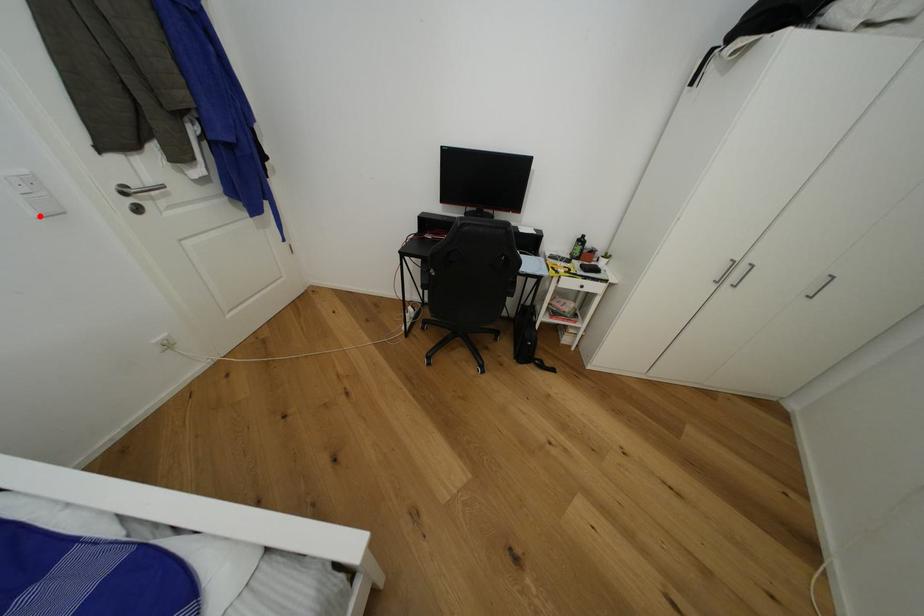
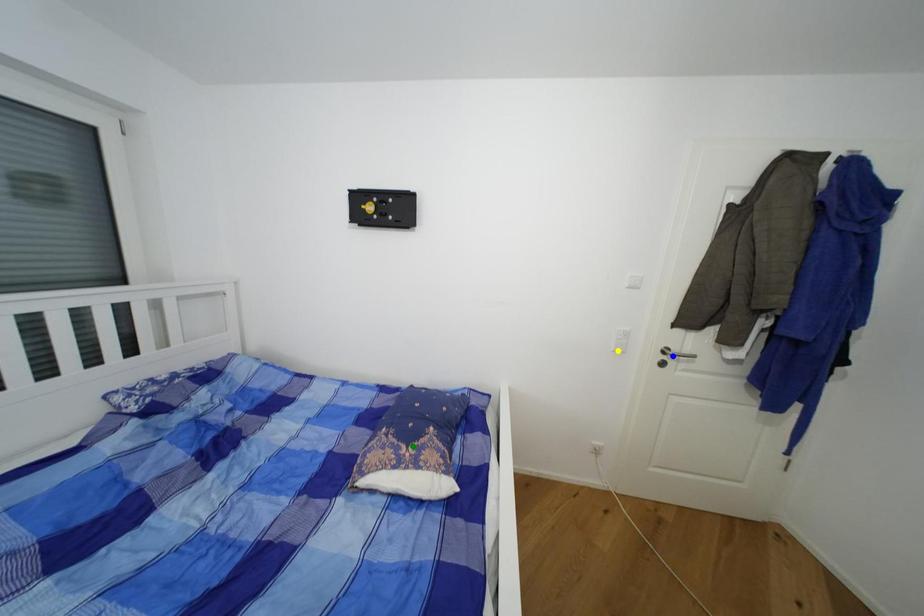
Question: I am providing you with two images of the same scene from different viewpoints. A red point is marked on the first image. You are given multiple points on the second image. Which mark in image 2 goes with the point in image 1?

Choices:
 (A) green point
 (B) blue point
 (C) yellow point

Answer: (C)